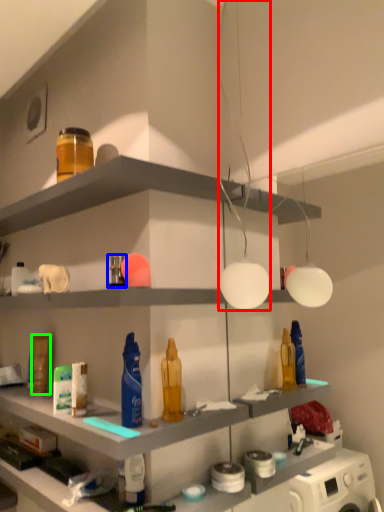
Question: Based on their relative distances, which object is nearer to light fixture (highlighted by a red box)? Choose from toiletry (highlighted by a blue box) and toiletry (highlighted by a green box).

Choices:
 (A) toiletry
 (B) toiletry

Answer: (A)